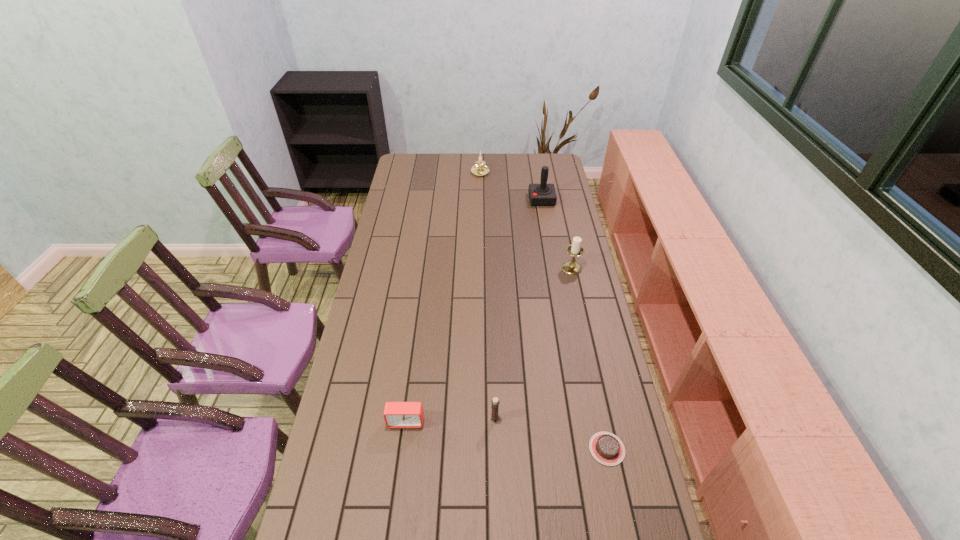
Find the location of a particular element. Image resolution: width=960 pixels, height=540 pixels. free space that satisfies the following two spatial constraints: 1. on the base of the joystick; 2. on the front side of the nearest candle holder is located at coordinates (581, 418).

You are a GUI agent. You are given a task and a screenshot of the screen. Output one action in this format:
    pyautogui.click(x=<x>, y=<y>)
    Task: Click on the free spot that satisfies the following two spatial constraints: 1. on the handle side of the fourth nearest object; 2. on the right side of the farthest object
    This screenshot has width=960, height=540.
    Given the screenshot: What is the action you would take?
    pyautogui.click(x=480, y=268)

At what (x,y) coordinates should I click in order to perform the action: click on free space that satisfies the following two spatial constraints: 1. on the handle side of the farthest object; 2. on the right side of the rightmost candle holder. Please return your answer as a coordinate pair (x, y). Looking at the image, I should click on (480, 268).

Find the location of a particular element. This screenshot has width=960, height=540. free space that satisfies the following two spatial constraints: 1. on the base of the second farthest object; 2. on the back side of the third farthest object is located at coordinates (554, 268).